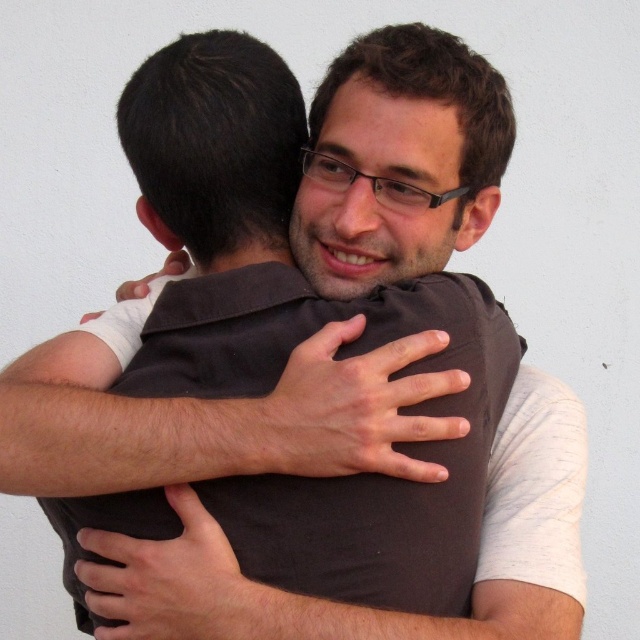
You are a photographer adjusting the lighting in the scene. You need to ensure that both the brown fabric arm at center and the dark brown fabric at center are evenly lit. Which object should you adjust the light towards to achieve this?

The brown fabric arm at center is positioned on the left side of dark brown fabric at center. To ensure both are evenly lit, adjust the light towards the brown fabric arm at center since it might be in a shadowed area compared to the darker fabric which may absorb more light.

You are a tailor measuring two pieces of fabric in the image. The brown fabric arm at center and the dark brown fabric at center. Which fabric is wider?

The dark brown fabric at center is wider than the brown fabric arm at center.